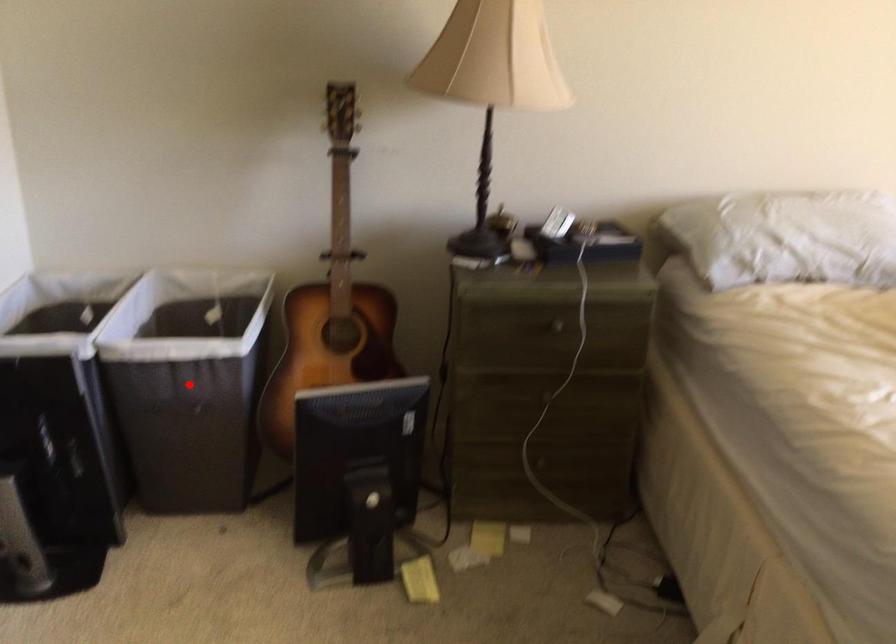
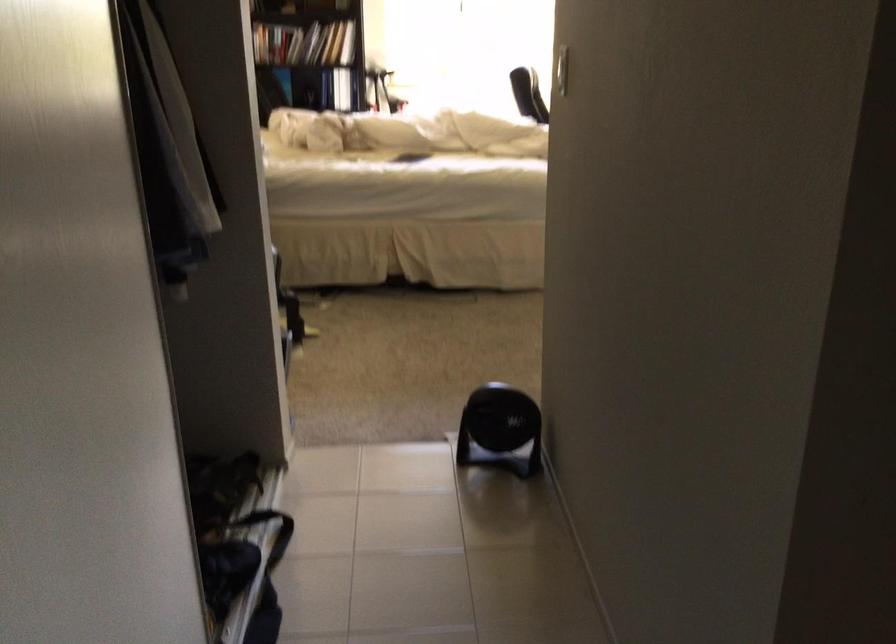
Question: I am providing you with two images of the same scene from different viewpoints. A red point is marked on the first image. Can you still see the location of the red point in image 2?

Choices:
 (A) Yes
 (B) No

Answer: (B)